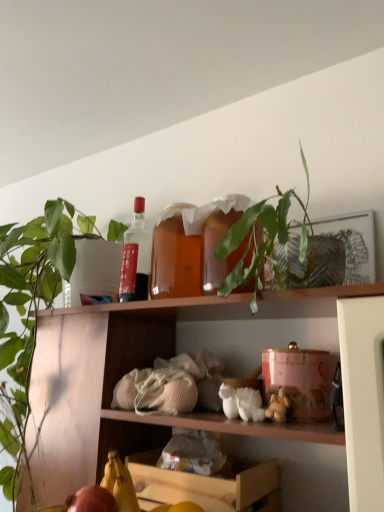
I want to click on free location above wooden crate at lower center (from a real-world perspective), so click(192, 460).